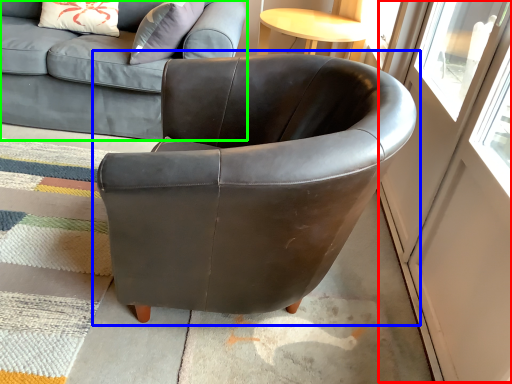
Question: Estimate the real-world distances between objects in this image. Which object is farther from screen door (highlighted by a red box), chair (highlighted by a blue box) or studio couch (highlighted by a green box)?

Choices:
 (A) chair
 (B) studio couch

Answer: (B)